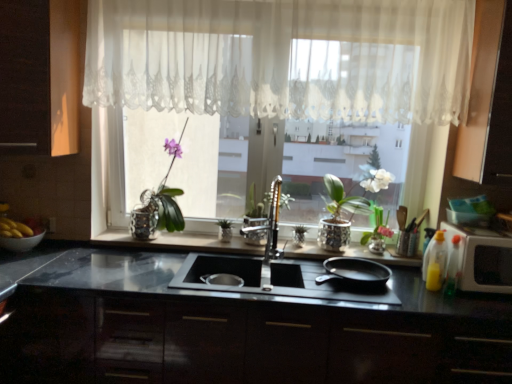
Question: Should I look upward or downward to see black matte frying pan at right?

Choices:
 (A) up
 (B) down

Answer: (B)

Question: Is translucent plastic bottle at right, which ranks as the 1th bottle in left-to-right order, surrounding dark wood cabinet at left, the third cabinetry from the bottom?

Choices:
 (A) no
 (B) yes

Answer: (A)

Question: Does translucent plastic bottle at right, the second bottle in the right-to-left sequence, turn towards dark wood cabinet at left, acting as the third cabinetry starting from the right?

Choices:
 (A) no
 (B) yes

Answer: (A)

Question: Does translucent plastic bottle at right, the second bottle in the right-to-left sequence, have a smaller size compared to dark wood cabinet at left, placed as the 1th cabinetry when sorted from top to bottom?

Choices:
 (A) no
 (B) yes

Answer: (B)

Question: Is translucent plastic bottle at right, which ranks as the 1th bottle in left-to-right order, looking in the opposite direction of dark wood cabinet at left, placed as the 1th cabinetry when sorted from top to bottom?

Choices:
 (A) no
 (B) yes

Answer: (A)

Question: Is translucent plastic bottle at right, the second bottle in the right-to-left sequence, further to the viewer compared to dark wood cabinet at left, acting as the third cabinetry starting from the right?

Choices:
 (A) yes
 (B) no

Answer: (A)

Question: Is translucent plastic bottle at right, the second bottle in the right-to-left sequence, shorter than dark wood cabinet at left, the third cabinetry from the bottom?

Choices:
 (A) yes
 (B) no

Answer: (A)

Question: Is white glossy microwave at right oriented away from white glossy pot at center?

Choices:
 (A) no
 (B) yes

Answer: (A)

Question: Considering the relative positions of white glossy microwave at right and white glossy pot at center in the image provided, is white glossy microwave at right to the left of white glossy pot at center from the viewer's perspective?

Choices:
 (A) yes
 (B) no

Answer: (B)

Question: Is white glossy microwave at right oriented towards white glossy pot at center?

Choices:
 (A) no
 (B) yes

Answer: (A)

Question: Is white glossy microwave at right outside white glossy pot at center?

Choices:
 (A) no
 (B) yes

Answer: (B)

Question: Considering the relative sizes of white glossy microwave at right and white glossy pot at center in the image provided, is white glossy microwave at right smaller than white glossy pot at center?

Choices:
 (A) no
 (B) yes

Answer: (B)

Question: Considering the relative sizes of white glossy microwave at right and white glossy pot at center in the image provided, is white glossy microwave at right bigger than white glossy pot at center?

Choices:
 (A) no
 (B) yes

Answer: (A)

Question: Is polished chrome faucet at center positioned far away from yellow matte bananas at left?

Choices:
 (A) yes
 (B) no

Answer: (A)